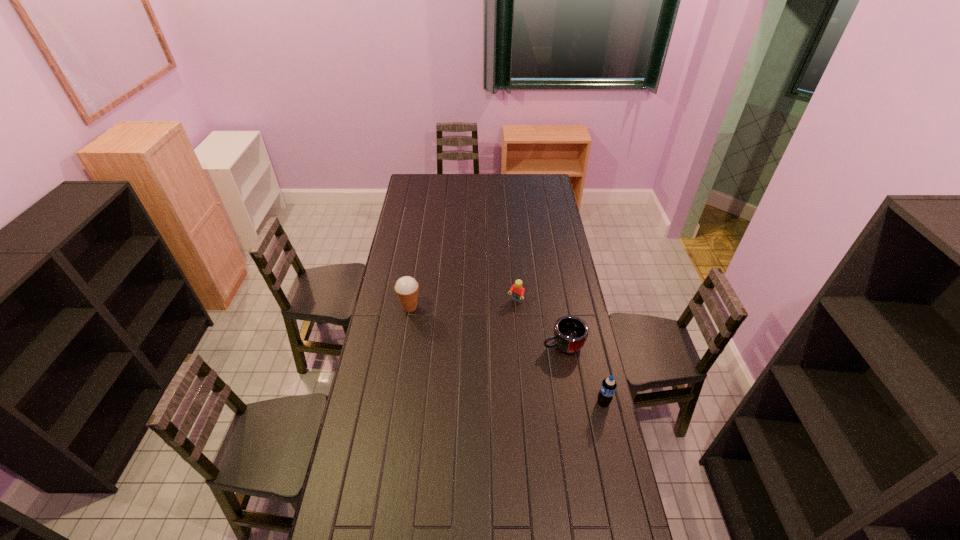
This screenshot has height=540, width=960. Find the location of `the leftmost object`. the leftmost object is located at coordinates (406, 287).

Where is `soda bottle`? soda bottle is located at coordinates (608, 386).

The width and height of the screenshot is (960, 540). What are the coordinates of `Lego` in the screenshot? It's located at (518, 291).

Identify the location of the third farthest object. (570, 332).

This screenshot has width=960, height=540. Identify the location of vacant space located 0.220m on the front of the icecream. (402, 355).

The height and width of the screenshot is (540, 960). In order to click on vacant space located on the back of the nearest object in this screenshot , I will do `click(588, 338)`.

Image resolution: width=960 pixels, height=540 pixels. Find the location of `vacant region located 0.280m on the face of the second object from left to right`. vacant region located 0.280m on the face of the second object from left to right is located at coordinates (x=479, y=346).

Find the location of a particular element. vacant space situated 0.350m on the face of the second object from left to right is located at coordinates (469, 357).

Locate an element on the screen. The width and height of the screenshot is (960, 540). vacant space located on the face of the second object from left to right is located at coordinates (493, 328).

You are a GUI agent. You are given a task and a screenshot of the screen. Output one action in this format:
    pyautogui.click(x=<x>, y=<y>)
    Task: Click on the free space located 0.360m on the side of the mug with the handle
    The image size is (960, 540).
    Given the screenshot: What is the action you would take?
    pyautogui.click(x=462, y=373)